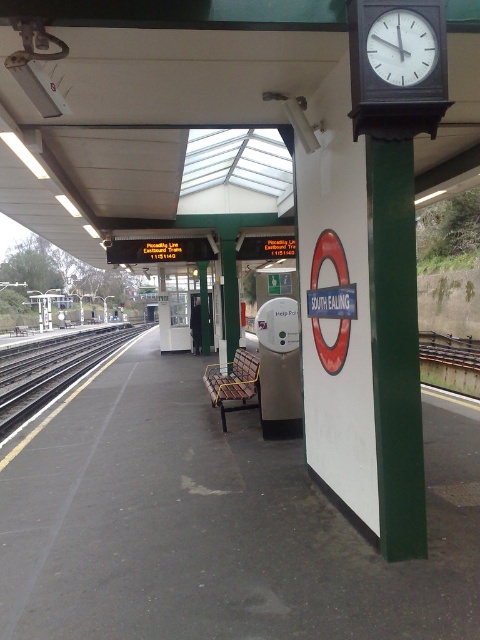
Question: Does green polished pole at right appear over black metal track at left?

Choices:
 (A) yes
 (B) no

Answer: (A)

Question: Which point appears farthest from the camera in this image?

Choices:
 (A) (415, 28)
 (B) (379, 218)
 (C) (33, 548)

Answer: (C)

Question: Can you confirm if green polished pole at right is thinner than white matte clock at upper right?

Choices:
 (A) no
 (B) yes

Answer: (B)

Question: Considering the relative positions of concrete platform at center and white matte clock at upper right in the image provided, where is concrete platform at center located with respect to white matte clock at upper right?

Choices:
 (A) left
 (B) right

Answer: (A)

Question: Which point appears closest to the camera in this image?

Choices:
 (A) (43, 387)
 (B) (424, 60)

Answer: (B)

Question: Which of these objects is positioned closest to the green polished pole at right?

Choices:
 (A) concrete platform at center
 (B) black metal track at left
 (C) white matte clock at upper right

Answer: (C)